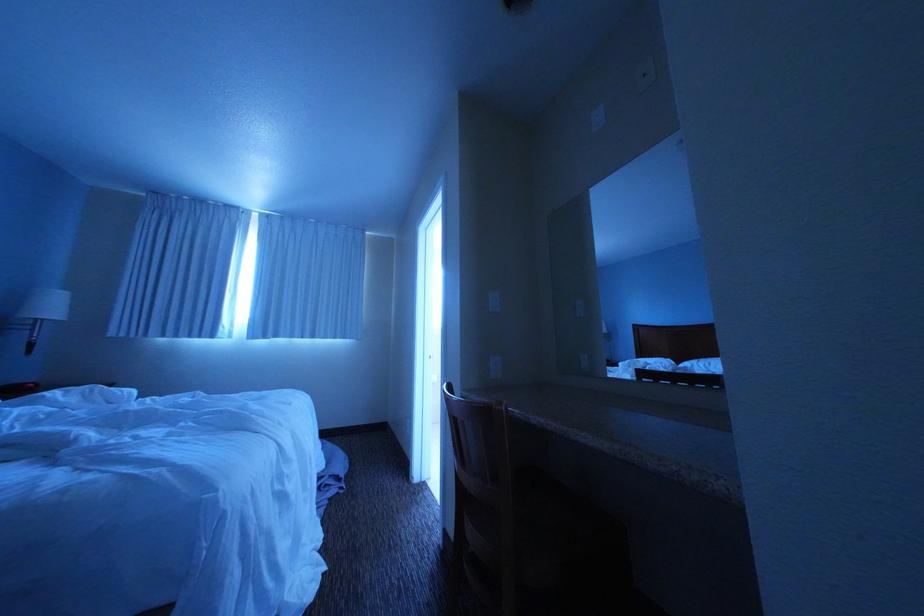
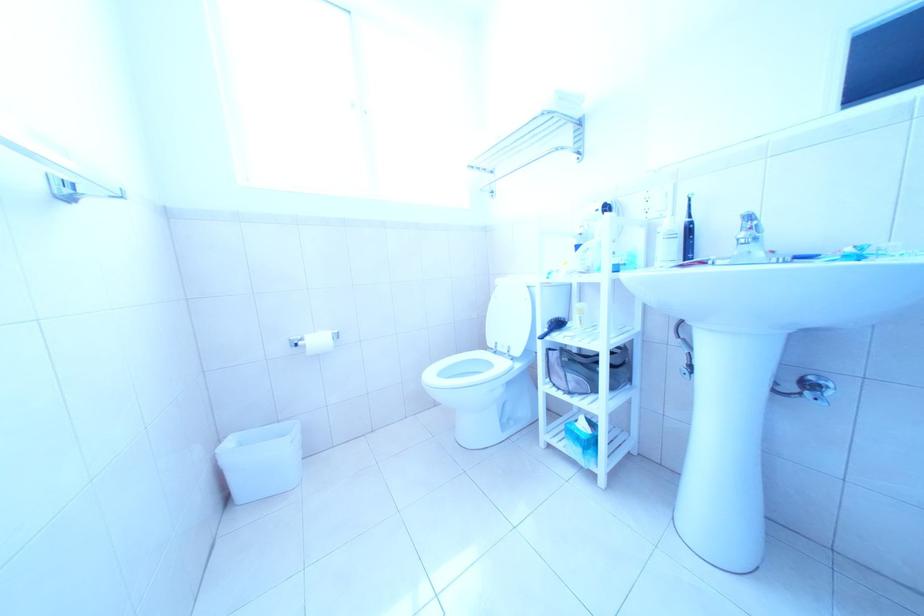
Question: Which direction would the cameraman need to move to produce the second image? Reply with the corresponding letter.

Choices:
 (A) Left
 (B) Right
 (C) Forward
 (D) Backward

Answer: (C)